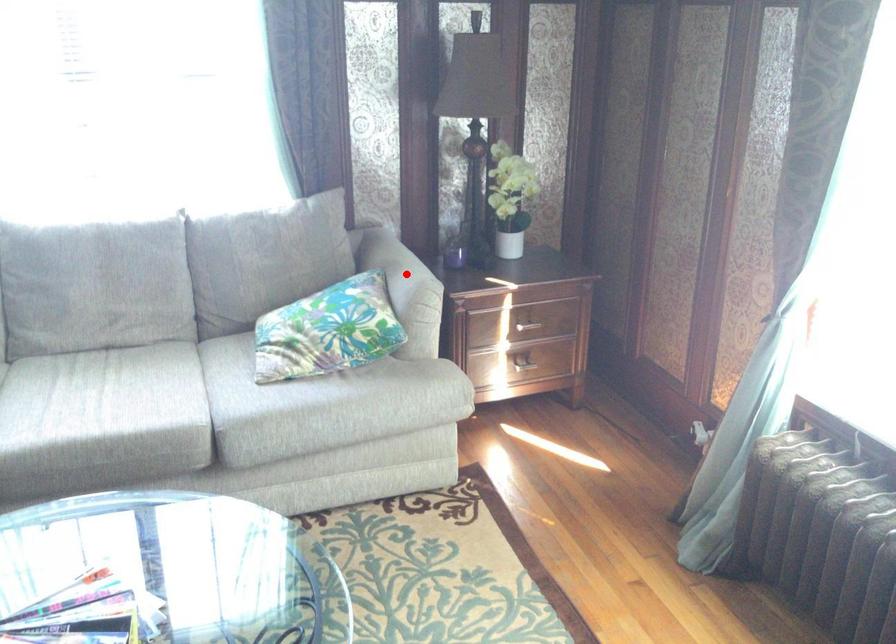
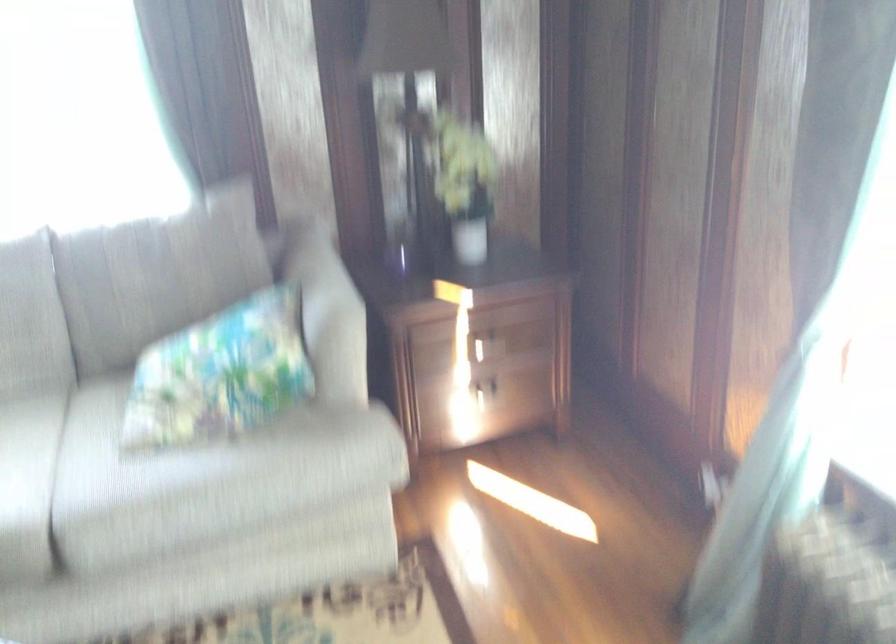
Find the pixel in the second image that matches the highlighted location in the first image.

(326, 296)